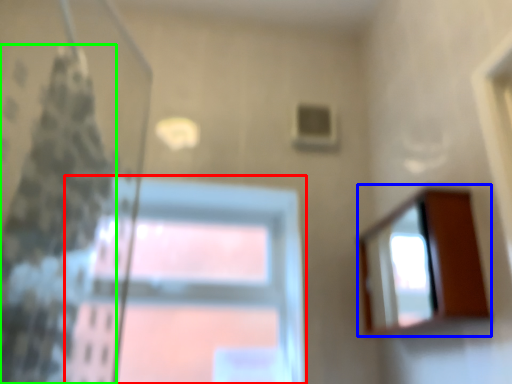
Question: Which is nearer to the window (highlighted by a red box)? mirror (highlighted by a blue box) or shower curtain (highlighted by a green box).

Choices:
 (A) mirror
 (B) shower curtain

Answer: (B)